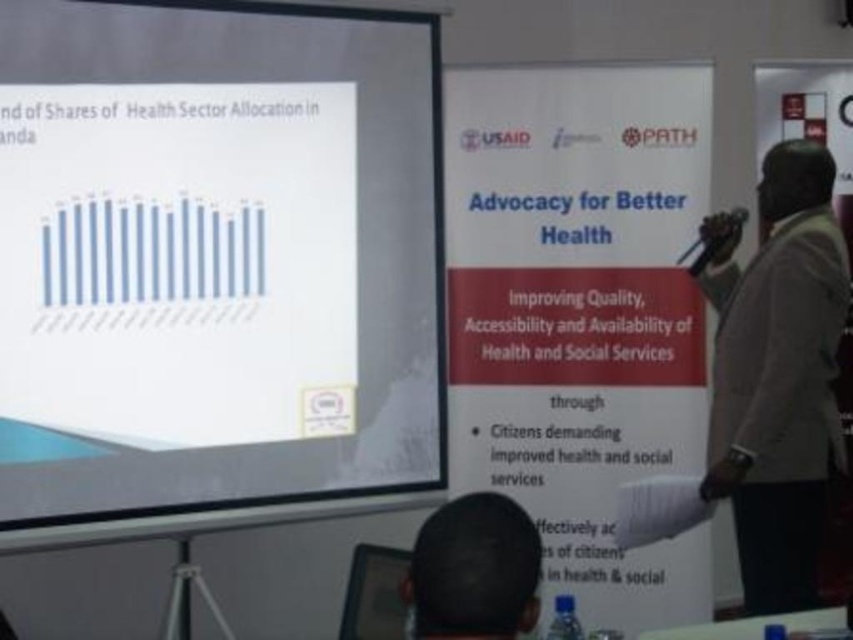
You are an attendee at the presentation. You notice the white matte projection screen at upper left and the brown fabric jacket at right. Which object is closer to the top of the image?

The white matte projection screen at upper left is positioned over the brown fabric jacket at right, meaning it is closer to the top of the image.